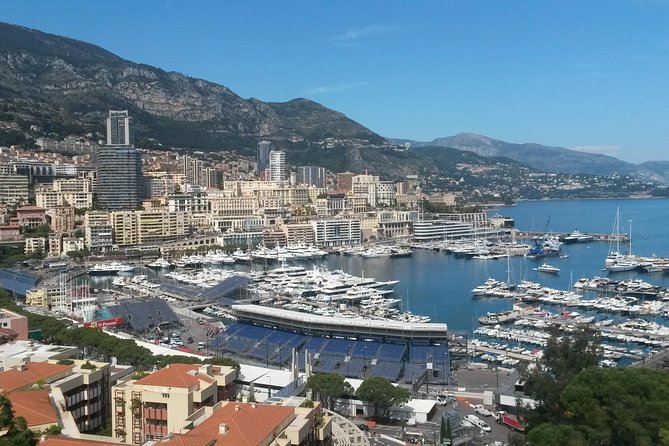
The height and width of the screenshot is (446, 669). I want to click on white roof, so click(39, 351), click(11, 347), click(269, 377), click(247, 371), click(353, 384), click(419, 410).